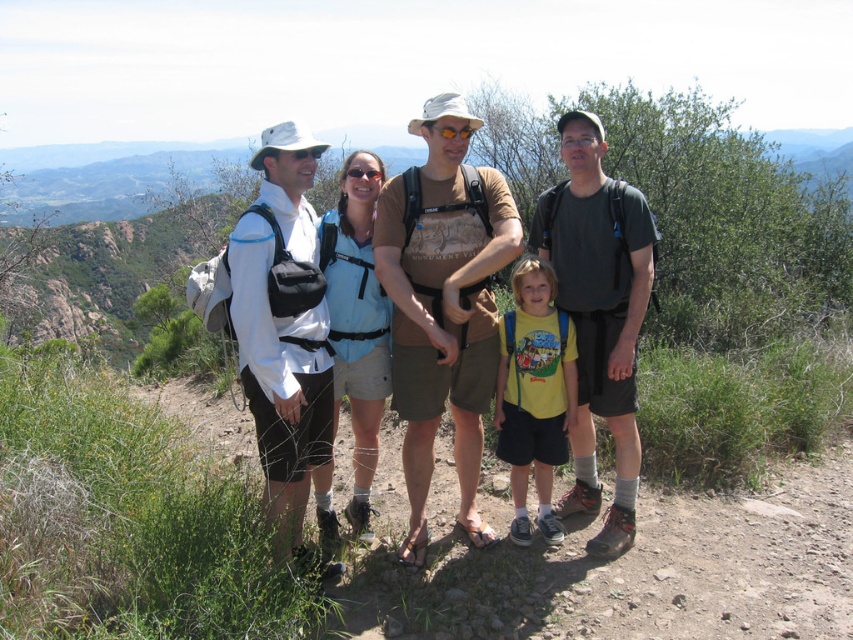
Question: Which object is closer to the camera taking this photo?

Choices:
 (A) yellow cotton shirt at center
 (B) matte black backpack at center

Answer: (B)

Question: Does matte black backpack at center appear on the left side of yellow cotton shirt at center?

Choices:
 (A) yes
 (B) no

Answer: (A)

Question: Does dark gray t-shirt at center appear on the left side of yellow cotton shirt at center?

Choices:
 (A) yes
 (B) no

Answer: (B)

Question: Is matte black backpack at center to the left of dark gray t-shirt at center from the viewer's perspective?

Choices:
 (A) no
 (B) yes

Answer: (B)

Question: Which point is farther from the camera taking this photo?

Choices:
 (A) (280, 554)
 (B) (488, 184)
 (C) (537, 483)

Answer: (C)

Question: Considering the real-world distances, which object is farthest from the yellow cotton shirt at center?

Choices:
 (A) white matte shirt at left
 (B) brown cotton t-shirt at center
 (C) dark gray t-shirt at center
 (D) matte black backpack at center

Answer: (A)